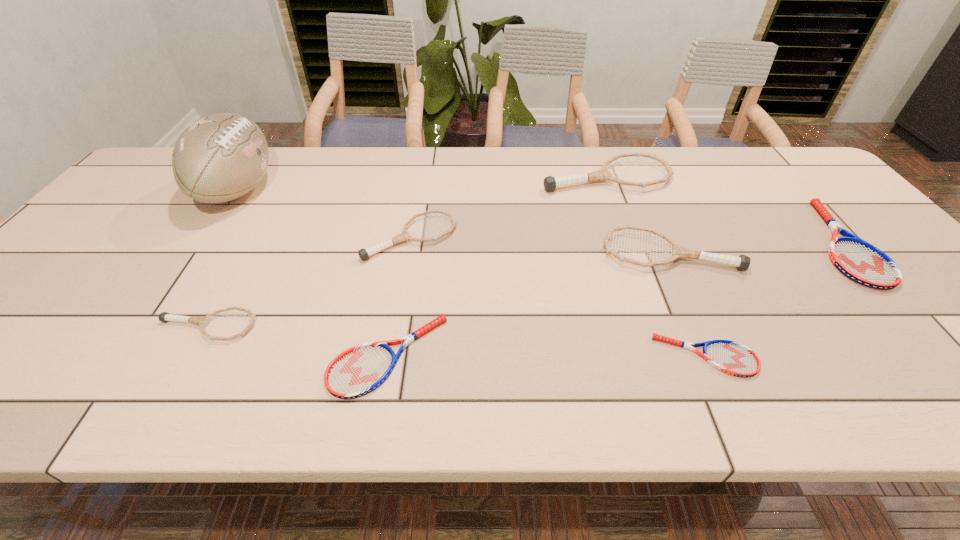
Where is `vacant area between the second smallest gray tennis racket and the second shortest tennis racket`? This screenshot has height=540, width=960. vacant area between the second smallest gray tennis racket and the second shortest tennis racket is located at coordinates click(x=399, y=296).

Locate an element on the screen. The height and width of the screenshot is (540, 960). vacant region between the third tallest object and the rightmost blue tennis racket is located at coordinates (755, 247).

The width and height of the screenshot is (960, 540). In order to click on free space between the tallest object and the nearest gray tennis racket in this screenshot , I will do `click(223, 258)`.

You are a GUI agent. You are given a task and a screenshot of the screen. Output one action in this format:
    pyautogui.click(x=<x>, y=<y>)
    Task: Click on the free point between the tallest tennis racket and the second shortest object
    This screenshot has height=540, width=960.
    Given the screenshot: What is the action you would take?
    pyautogui.click(x=497, y=266)

The width and height of the screenshot is (960, 540). Identify the location of free spot between the second tallest tennis racket and the farthest blue tennis racket. (755, 247).

Locate an element on the screen. Image resolution: width=960 pixels, height=540 pixels. free space between the shortest tennis racket and the second biggest blue tennis racket is located at coordinates (547, 356).

In order to click on free spot between the second shortest tennis racket and the football (American) in this screenshot , I will do `click(313, 273)`.

This screenshot has height=540, width=960. I want to click on free spot between the nearest gray tennis racket and the tallest object, so click(223, 258).

At what (x,y) coordinates should I click in order to perform the action: click on vacant space that is in between the leftmost blue tennis racket and the biggest blue tennis racket. Please return your answer as a coordinate pair (x, y). The width and height of the screenshot is (960, 540). Looking at the image, I should click on (614, 299).

Locate an element on the screen. Image resolution: width=960 pixels, height=540 pixels. object that stands as the fifth closest to the leftmost blue tennis racket is located at coordinates (221, 157).